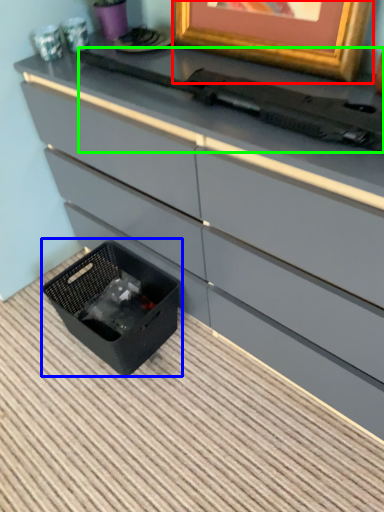
Question: Considering the real-world distances, which object is farthest from picture frame (highlighted by a red box)? storage box (highlighted by a blue box) or typewriter (highlighted by a green box)?

Choices:
 (A) storage box
 (B) typewriter

Answer: (A)